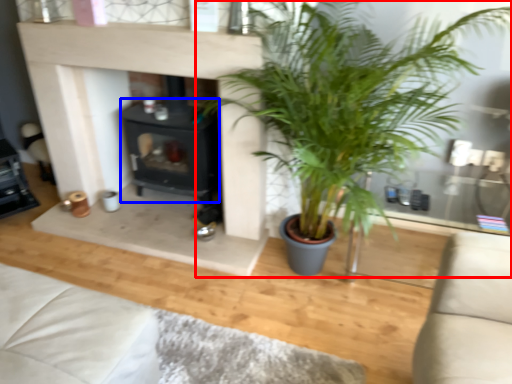
Question: Among these objects, which one is nearest to the camera, houseplant (highlighted by a red box) or fireplace (highlighted by a blue box)?

Choices:
 (A) houseplant
 (B) fireplace

Answer: (A)